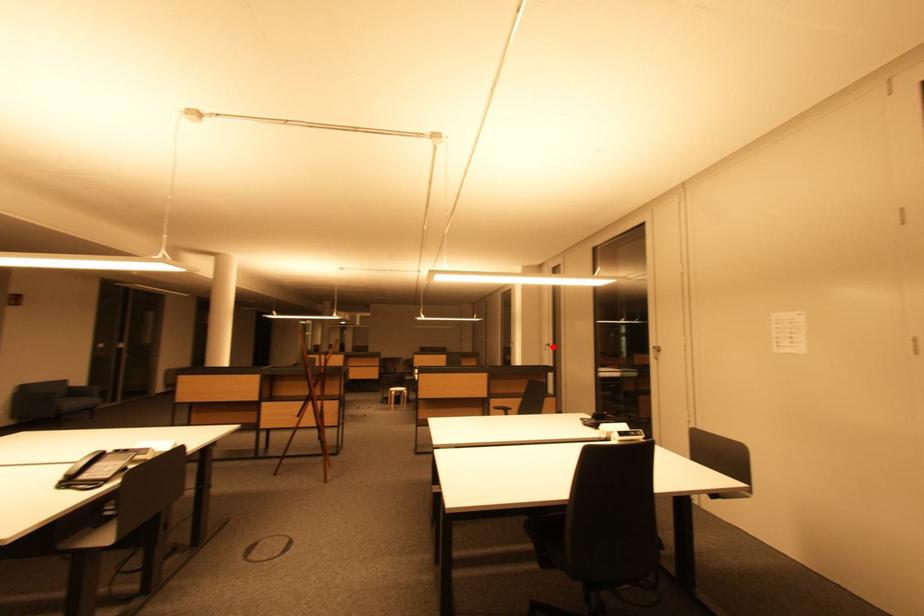
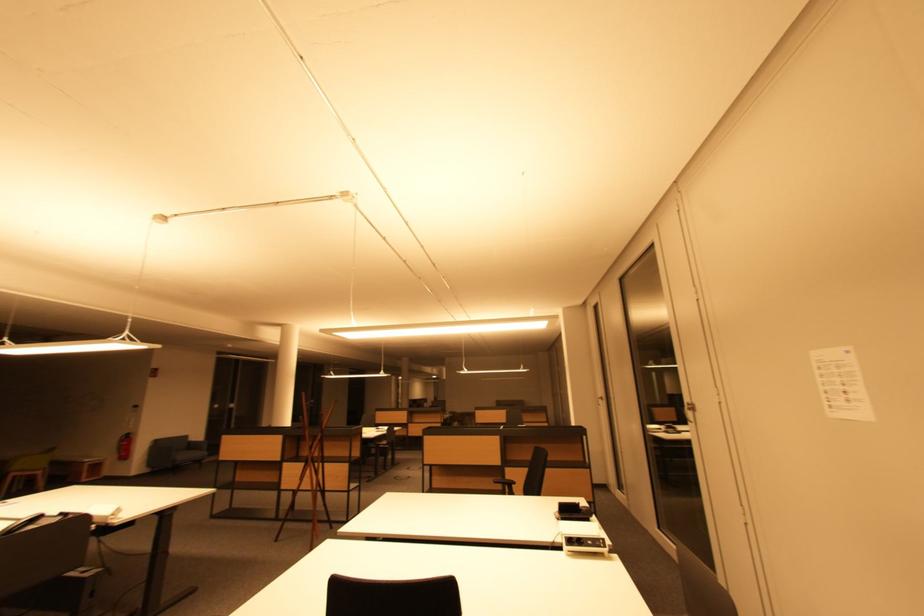
The point at the highlighted location is marked in the first image. Where is the corresponding point in the second image?

(605, 400)